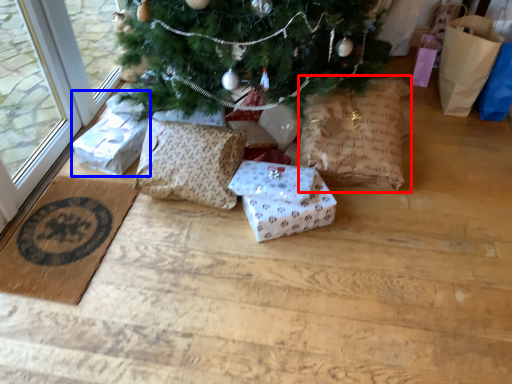
Question: Which object appears farthest to the camera in this image, shopping bag (highlighted by a red box) or gift box (highlighted by a blue box)?

Choices:
 (A) shopping bag
 (B) gift box

Answer: (B)